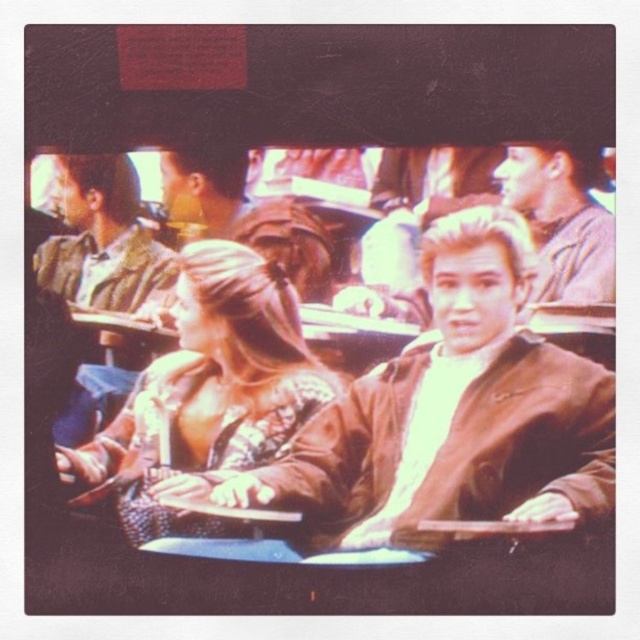
Is brown leather jacket at center positioned before matte brown jacket at upper right?

No.

Is brown leather jacket at center behind matte brown jacket at upper right?

Yes, brown leather jacket at center is behind matte brown jacket at upper right.

Between point (401, 364) and point (612, 230), which one is positioned behind?

The point (401, 364) is behind.

Where is `brown leather jacket at center`? This screenshot has height=640, width=640. brown leather jacket at center is located at coordinates pos(456,412).

Does brown leather jacket at center have a greater width compared to striped shirt at left?

Correct, the width of brown leather jacket at center exceeds that of striped shirt at left.

Is point (608, 497) closer to camera compared to point (49, 243)?

Yes, point (608, 497) is in front of point (49, 243).

Image resolution: width=640 pixels, height=640 pixels. I want to click on brown leather jacket at center, so (456, 412).

Does leather jacket at center have a smaller size compared to matte brown jacket at upper right?

Actually, leather jacket at center might be larger than matte brown jacket at upper right.

The image size is (640, 640). What do you see at coordinates (208, 392) in the screenshot?
I see `leather jacket at center` at bounding box center [208, 392].

Where is `leather jacket at center`? The width and height of the screenshot is (640, 640). leather jacket at center is located at coordinates (208, 392).

Find the location of `leather jacket at center`. leather jacket at center is located at coordinates (x=208, y=392).